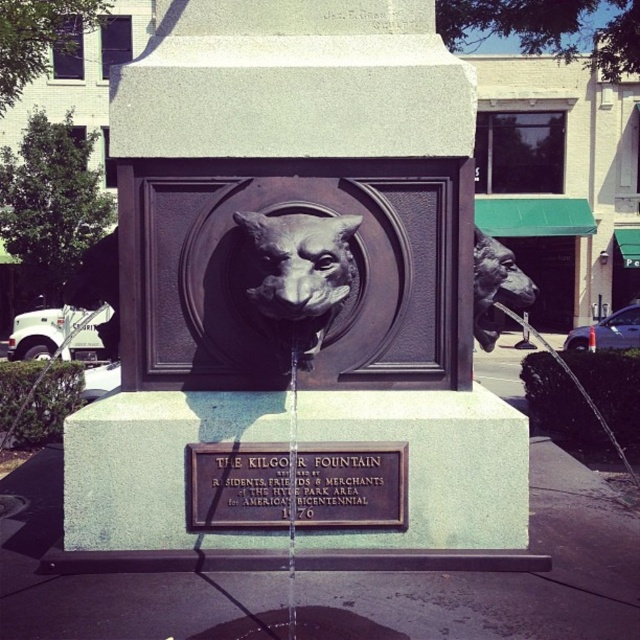
You are a tourist standing in front of The Kilgo Fountain. You notice the bronze plaque at center and the bronze statue at right. Which object is positioned lower in the scene?

The bronze plaque at center is located below the bronze statue at right, so it is positioned lower in the scene.

You are a visitor standing in front of The Kilgo Fountain. You notice the bronze plaque at center and the bronze statue at right. Which object is taller?

The bronze statue at right is taller than the bronze plaque at center.